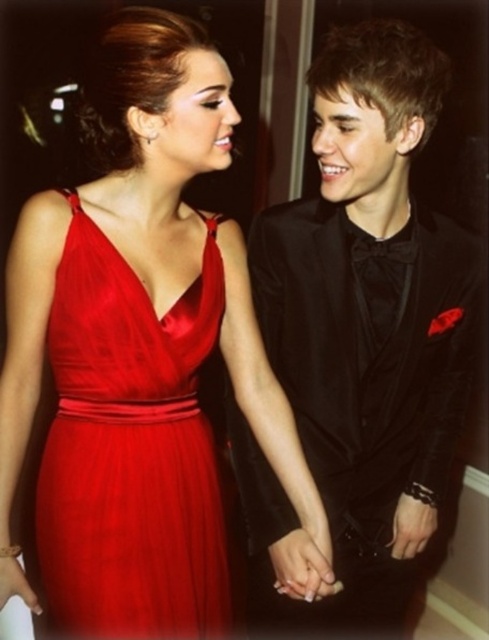
Question: Is black satin suit at center above satin red dress at center?

Choices:
 (A) yes
 (B) no

Answer: (A)

Question: Which point is farther to the camera?

Choices:
 (A) satin dress at center
 (B) black satin suit at center
 (C) satin red dress at center

Answer: (B)

Question: Is satin dress at center behind satin red dress at center?

Choices:
 (A) no
 (B) yes

Answer: (A)

Question: Which object appears farthest from the camera in this image?

Choices:
 (A) satin red dress at center
 (B) satin dress at center

Answer: (A)

Question: From the image, what is the correct spatial relationship of satin dress at center in relation to satin red dress at center?

Choices:
 (A) below
 (B) above

Answer: (B)

Question: Which object appears farthest from the camera in this image?

Choices:
 (A) black satin suit at center
 (B) satin red dress at center
 (C) satin dress at center

Answer: (A)